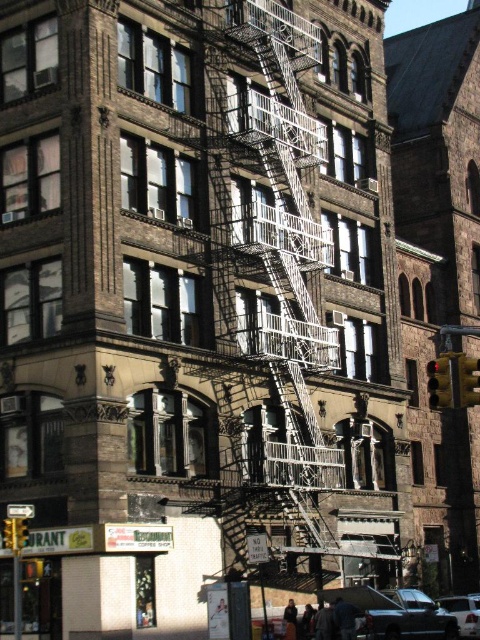
Can you confirm if metallic silver car at lower right is positioned to the right of yellow plastic traffic light at lower left?

Correct, you'll find metallic silver car at lower right to the right of yellow plastic traffic light at lower left.

Which is in front, point (467, 596) or point (10, 525)?

Point (10, 525)

Which is in front, point (463, 636) or point (14, 545)?

Point (14, 545) is in front.

You are a GUI agent. You are given a task and a screenshot of the screen. Output one action in this format:
    pyautogui.click(x=<x>, y=<y>)
    Task: Click on the metallic silver car at lower right
    The width and height of the screenshot is (480, 640).
    Given the screenshot: What is the action you would take?
    pyautogui.click(x=464, y=612)

Between point (455, 394) and point (448, 392), which one is positioned behind?

The point (448, 392) is behind.

Can you confirm if metallic yellow traffic light at right is positioned to the left of yellow-green glass traffic light at right?

Correct, you'll find metallic yellow traffic light at right to the left of yellow-green glass traffic light at right.

Does point (472, 368) come behind point (443, 380)?

No.

Where is `metallic yellow traffic light at right`? Image resolution: width=480 pixels, height=640 pixels. metallic yellow traffic light at right is located at coordinates (466, 380).

Who is positioned more to the right, shiny black car at lower right or metallic silver car at lower right?

From the viewer's perspective, metallic silver car at lower right appears more on the right side.

Between shiny black car at lower right and metallic silver car at lower right, which one is positioned lower?

metallic silver car at lower right is lower down.

The width and height of the screenshot is (480, 640). What do you see at coordinates (408, 618) in the screenshot?
I see `shiny black car at lower right` at bounding box center [408, 618].

Locate an element on the screen. This screenshot has width=480, height=640. shiny black car at lower right is located at coordinates (408, 618).